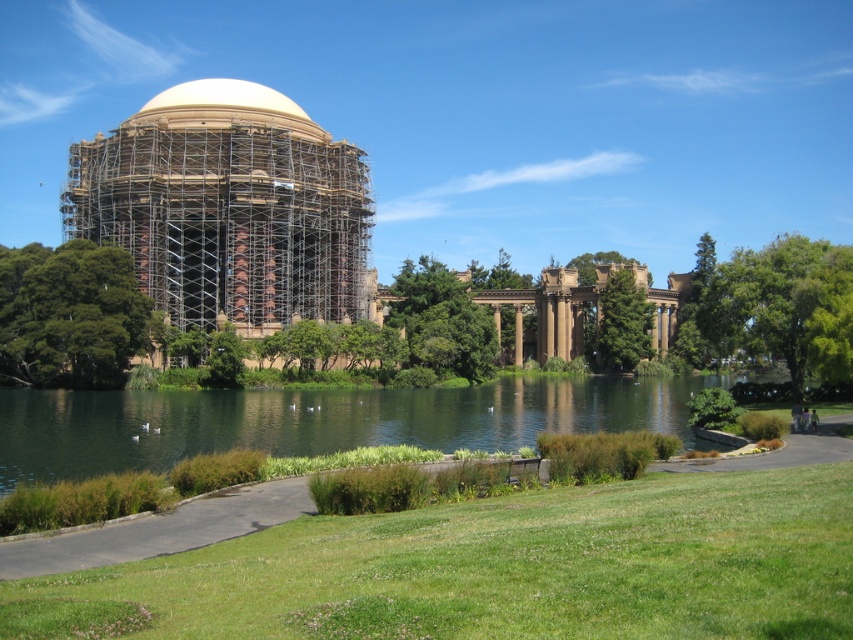
Between green leafy tree at right and brown stone columns at center, which one has more height?

green leafy tree at right is taller.

Is green leafy tree at right wider than brown stone columns at center?

Indeed, green leafy tree at right has a greater width compared to brown stone columns at center.

Does point (834, 264) come farther from viewer compared to point (549, 298)?

No.

Where is `green leafy tree at right`? This screenshot has height=640, width=853. green leafy tree at right is located at coordinates (782, 307).

Is brown stone columns at center to the left of white textured dome at upper center from the viewer's perspective?

Incorrect, brown stone columns at center is not on the left side of white textured dome at upper center.

Does point (418, 273) lie in front of point (300, 116)?

That is True.

The width and height of the screenshot is (853, 640). What are the coordinates of `brown stone columns at center` in the screenshot? It's located at (572, 310).

Between beige stone dome at center and brown stone columns at center, which one is positioned higher?

beige stone dome at center is above.

Measure the distance between point (258, 198) and camera.

96.09 meters

Locate an element on the screen. beige stone dome at center is located at coordinates (228, 208).

This screenshot has height=640, width=853. In order to click on beige stone dome at center in this screenshot , I will do `click(228, 208)`.